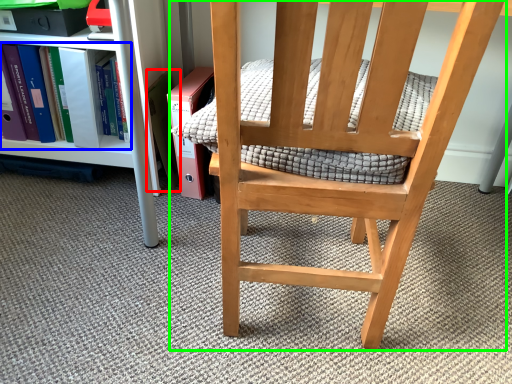
Question: Which object is the farthest from paperback book (highlighted by a red box)? Choose among these: book (highlighted by a blue box) or chair (highlighted by a green box).

Choices:
 (A) book
 (B) chair

Answer: (B)